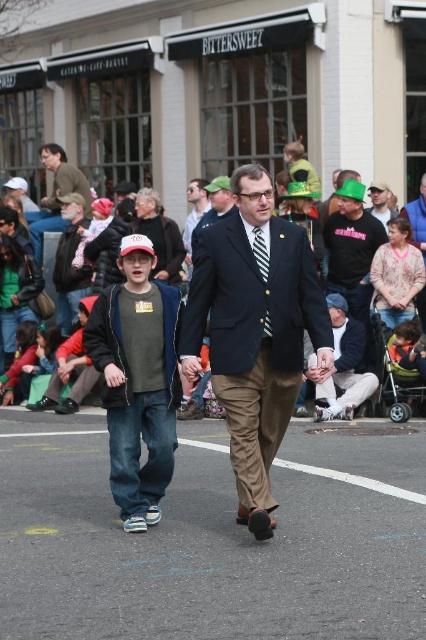
You are a photographer trying to capture a candid shot of the navy blue suit at center and denim jeans at center. Since you want to ensure both are clearly visible, which one should you focus on first considering their sizes?

The navy blue suit at center is bigger than denim jeans at center, so you should focus on the navy blue suit at center first as it occupies more space in the frame and will require proper focus to ensure clarity.

You are a fashion designer observing the street scene. You notice the denim jeans at center and the denim jacket at lower left. Which item of clothing has a greater height measurement?

The denim jeans at center has a greater height compared to the denim jacket at lower left.

You are a photographer positioned at the origin point of the image coordinate system. You need to capture a photo of the denim jeans at center. What are the coordinates where you should aim your camera?

The denim jeans at center is located at point (138, 380), so you should aim your camera at those coordinates to capture the denim jeans at center.